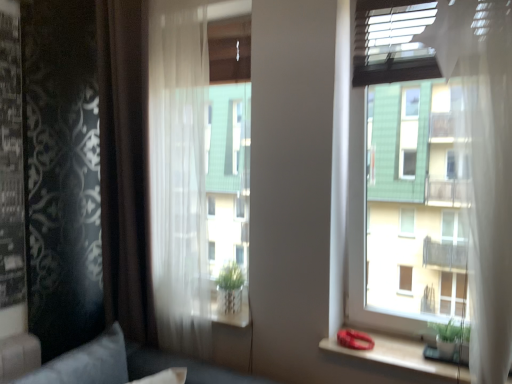
Question: Is point (96, 379) closer or farther from the camera than point (493, 230)?

Choices:
 (A) farther
 (B) closer

Answer: (A)

Question: Which is correct: velvet gray pillow at lower left is inside transparent glass window at upper right, or outside of it?

Choices:
 (A) outside
 (B) inside

Answer: (A)

Question: Considering the real-world distances, which object is farthest from the sheer white curtain at center, the second curtain when ordered from left to right?

Choices:
 (A) transparent glass window at upper right
 (B) brown sheer curtain at left, which is the 2th curtain from right to left
 (C) velvet gray pillow at lower left
 (D) wooden at right

Answer: (A)

Question: Based on their relative distances, which object is nearer to the brown sheer curtain at left, positioned as the 1th curtain in left-to-right order?

Choices:
 (A) velvet gray pillow at lower left
 (B) transparent glass window at upper right
 (C) wooden at right
 (D) sheer white curtain at center, the 1th curtain when ordered from right to left

Answer: (D)